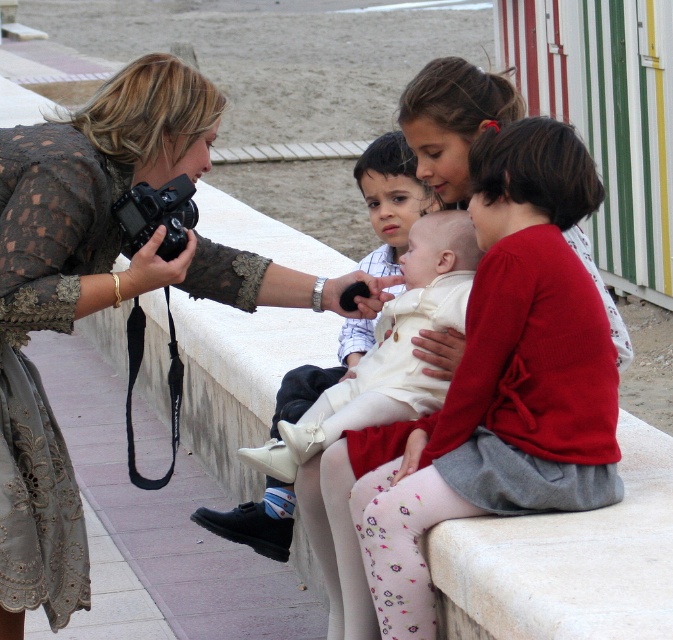
Looking at this image, between matte lace dress at upper left and white matte shirt at center, which one has less height?

white matte shirt at center is shorter.

Who is lower down, matte lace dress at upper left or white matte shirt at center?

A: Positioned lower is matte lace dress at upper left.

Find the location of a particular element. The width and height of the screenshot is (673, 640). matte lace dress at upper left is located at coordinates (100, 292).

Which of these two, matte lace dress at upper left or black plastic camera at left, stands shorter?

black plastic camera at left is shorter.

Who is positioned more to the right, matte lace dress at upper left or black plastic camera at left?

From the viewer's perspective, black plastic camera at left appears more on the right side.

Identify the location of matte lace dress at upper left. The width and height of the screenshot is (673, 640). (100, 292).

Is white matte shirt at center wider than black plastic camera at left?

Yes.

Is point (219, 532) positioned after point (145, 196)?

Yes, it is behind point (145, 196).

Where is `white matte shirt at center`? This screenshot has height=640, width=673. white matte shirt at center is located at coordinates (390, 198).